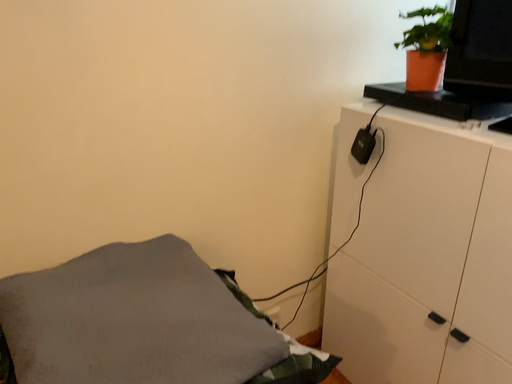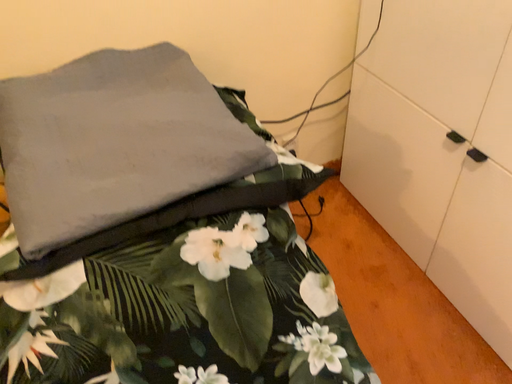
Question: Which way did the camera rotate in the video?

Choices:
 (A) rotated downward
 (B) rotated upward

Answer: (A)